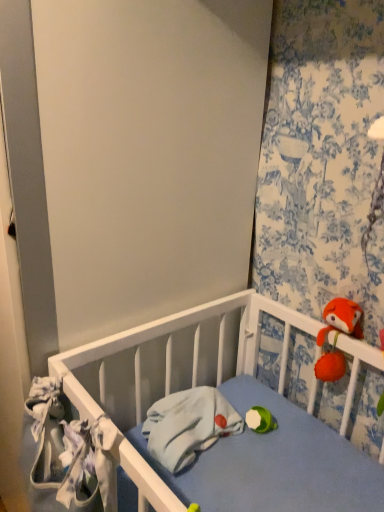
Question: Is light blue fabric at center, arranged as the first material when viewed from the right, wider than fluffy orange plush at upper right?

Choices:
 (A) no
 (B) yes

Answer: (B)

Question: Is fluffy orange plush at upper right completely or partially inside light blue fabric at center, which ranks as the second material in left-to-right order?

Choices:
 (A) no
 (B) yes

Answer: (A)

Question: Considering the relative sizes of light blue fabric at center, which appears as the second material when viewed from the front, and fluffy orange plush at upper right in the image provided, is light blue fabric at center, which appears as the second material when viewed from the front, thinner than fluffy orange plush at upper right?

Choices:
 (A) yes
 (B) no

Answer: (B)

Question: Considering the relative positions of light blue fabric at center, which ranks as the second material in left-to-right order, and fluffy orange plush at upper right in the image provided, is light blue fabric at center, which ranks as the second material in left-to-right order, to the right of fluffy orange plush at upper right from the viewer's perspective?

Choices:
 (A) yes
 (B) no

Answer: (B)

Question: Does light blue fabric at center, which appears as the second material when viewed from the front, have a smaller size compared to fluffy orange plush at upper right?

Choices:
 (A) yes
 (B) no

Answer: (B)

Question: In terms of width, does light blue fabric at center, arranged as the first material when viewed from the right, look wider or thinner when compared to fluffy orange plush at upper right?

Choices:
 (A) wide
 (B) thin

Answer: (A)

Question: In the image, is light blue fabric at center, which ranks as the second material in left-to-right order, positioned in front of or behind fluffy orange plush at upper right?

Choices:
 (A) behind
 (B) front

Answer: (B)

Question: Visually, is light blue fabric at center, which ranks as the second material in left-to-right order, positioned to the left or to the right of fluffy orange plush at upper right?

Choices:
 (A) right
 (B) left

Answer: (B)

Question: In terms of size, does light blue fabric at center, which appears as the second material when viewed from the front, appear bigger or smaller than fluffy orange plush at upper right?

Choices:
 (A) small
 (B) big

Answer: (B)

Question: Is floral fabric curtain at upper right inside or outside of fluffy orange plush at upper right?

Choices:
 (A) outside
 (B) inside

Answer: (A)

Question: In terms of size, does floral fabric curtain at upper right appear bigger or smaller than fluffy orange plush at upper right?

Choices:
 (A) small
 (B) big

Answer: (B)

Question: Is floral fabric curtain at upper right wider or thinner than fluffy orange plush at upper right?

Choices:
 (A) wide
 (B) thin

Answer: (B)

Question: Considering the positions of point (302, 243) and point (322, 369), is point (302, 243) closer or farther from the camera than point (322, 369)?

Choices:
 (A) farther
 (B) closer

Answer: (A)

Question: Is white fabric at left, marked as the 2th material in a back-to-front arrangement, inside or outside of light blue fabric at center, which appears as the second material when viewed from the front?

Choices:
 (A) outside
 (B) inside

Answer: (A)

Question: In the image, is white fabric at left, marked as the 2th material in a back-to-front arrangement, on the left side or the right side of light blue fabric at center, which appears as the second material when viewed from the front?

Choices:
 (A) right
 (B) left

Answer: (B)